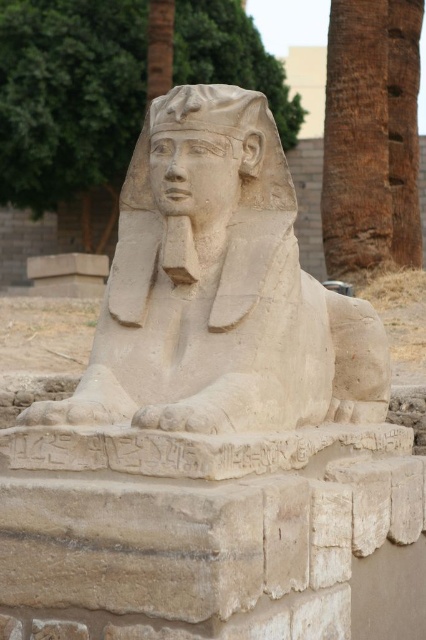
Question: Which is nearer to the brown textured palm tree at upper right?

Choices:
 (A) beige stone head at center
 (B) beige stone sphinx at center

Answer: (B)

Question: Which point is closer to the camera taking this photo?

Choices:
 (A) (249, 104)
 (B) (222, 218)

Answer: (B)

Question: Estimate the real-world distances between objects in this image. Which object is closer to the beige stone sphinx at center?

Choices:
 (A) brown textured palm tree at upper right
 (B) beige stone head at center

Answer: (B)

Question: Is the position of beige stone sphinx at center more distant than that of beige stone head at center?

Choices:
 (A) yes
 (B) no

Answer: (B)

Question: Can you confirm if brown textured palm tree at upper right is positioned to the right of beige stone head at center?

Choices:
 (A) yes
 (B) no

Answer: (A)

Question: Can you confirm if beige stone sphinx at center is positioned to the right of brown textured palm tree at upper right?

Choices:
 (A) no
 (B) yes

Answer: (A)